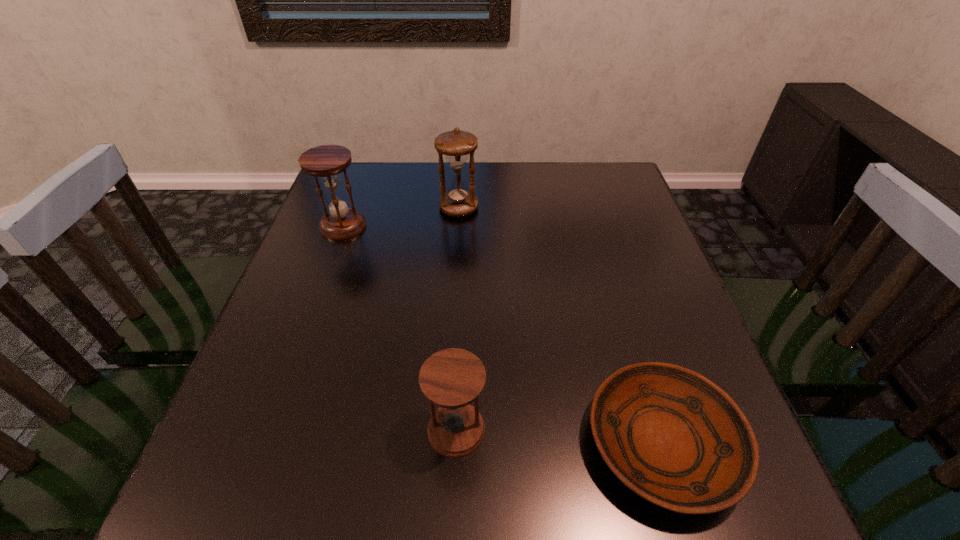
The image size is (960, 540). In order to click on free space that is in between the nearest hourglass and the rightmost object in this screenshot , I will do point(560,437).

The image size is (960, 540). Identify the location of free space that is in between the leftmost object and the rightmost object. (503, 335).

Image resolution: width=960 pixels, height=540 pixels. In order to click on the third closest object to the leftmost hourglass in this screenshot , I will do `click(673, 437)`.

Where is `object identified as the closest to the leftmost hourglass`? The image size is (960, 540). object identified as the closest to the leftmost hourglass is located at coordinates (460, 200).

Identify which hourglass is located as the nearest to the leftmost hourglass. Please provide its 2D coordinates. Your answer should be formatted as a tuple, i.e. [(x, y)], where the tuple contains the x and y coordinates of a point satisfying the conditions above.

[(460, 200)]

Find the location of `hourglass that can be found as the second closest to the shortest hourglass`. hourglass that can be found as the second closest to the shortest hourglass is located at coordinates (460, 200).

Identify the location of vacant space that satisfies the following two spatial constraints: 1. on the front side of the leftmost object; 2. on the left side of the plate. The width and height of the screenshot is (960, 540). (264, 444).